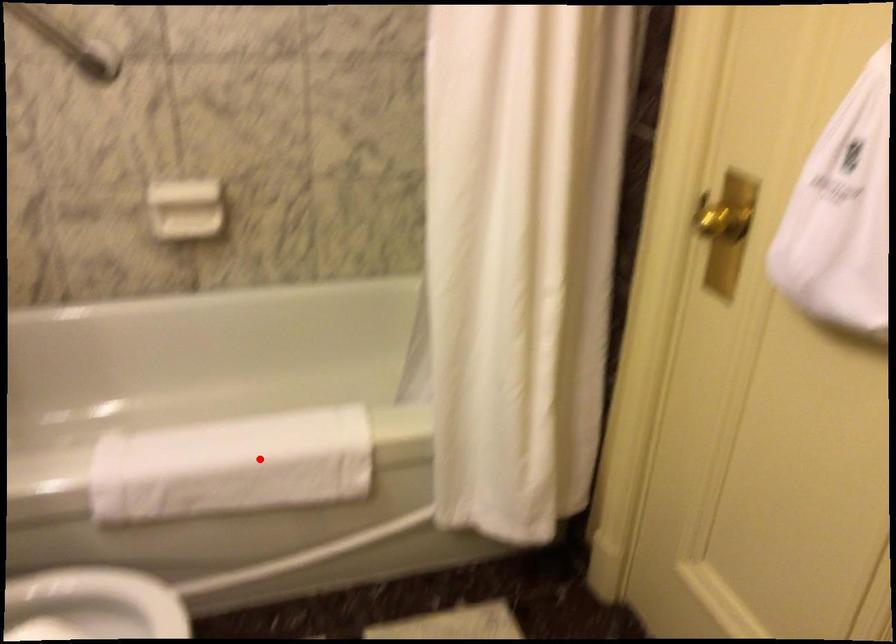
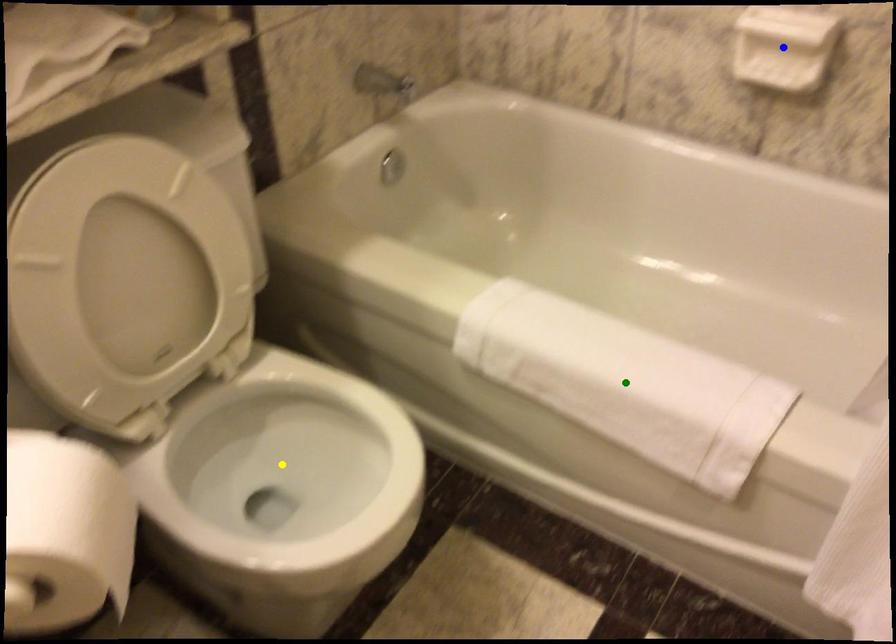
Question: I am providing you with two images of the same scene from different viewpoints. A red point is marked on the first image. You are given multiple points on the second image. Which point in image 2 is actually the same real-world point as the red point in image 1?

Choices:
 (A) yellow point
 (B) blue point
 (C) green point

Answer: (C)